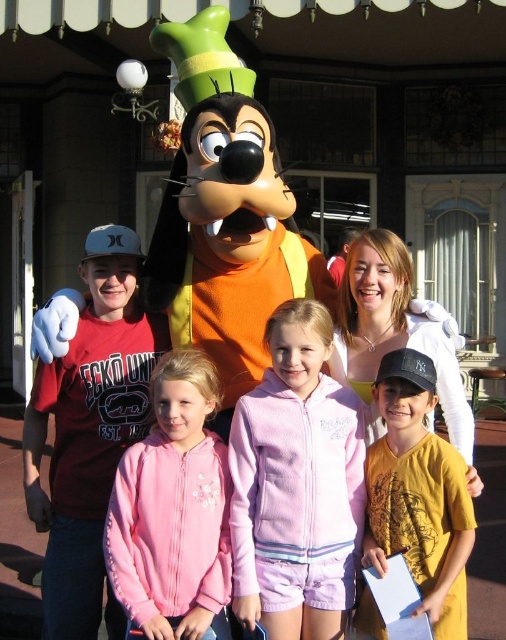
Question: Which point is closer to the camera?

Choices:
 (A) pink fleece jacket at center
 (B) yellow cotton shirt at center
 (C) white cotton shirt at center

Answer: (B)

Question: Which point is farther to the camera?

Choices:
 (A) (151, 458)
 (B) (367, 440)
 (C) (414, 545)

Answer: (B)

Question: From the image, what is the correct spatial relationship of pink fleece jacket at center in relation to yellow cotton shirt at center?

Choices:
 (A) left
 (B) right

Answer: (A)

Question: Does yellow cotton shirt at center have a greater width compared to white cotton shirt at center?

Choices:
 (A) no
 (B) yes

Answer: (A)

Question: Among these points, which one is farthest from the camera?

Choices:
 (A) (367, 534)
 (B) (173, 528)
 (C) (275, 454)
 (D) (358, 388)

Answer: (D)

Question: Does pink fleece hoodie at center lie behind pink fleece jacket at center?

Choices:
 (A) no
 (B) yes

Answer: (B)